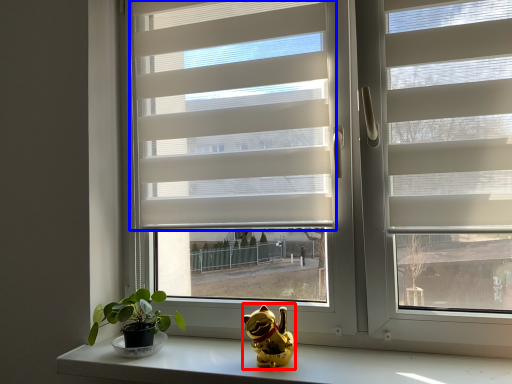
Question: Among these objects, which one is farthest to the camera, figurine (highlighted by a red box) or window blind (highlighted by a blue box)?

Choices:
 (A) figurine
 (B) window blind

Answer: (B)